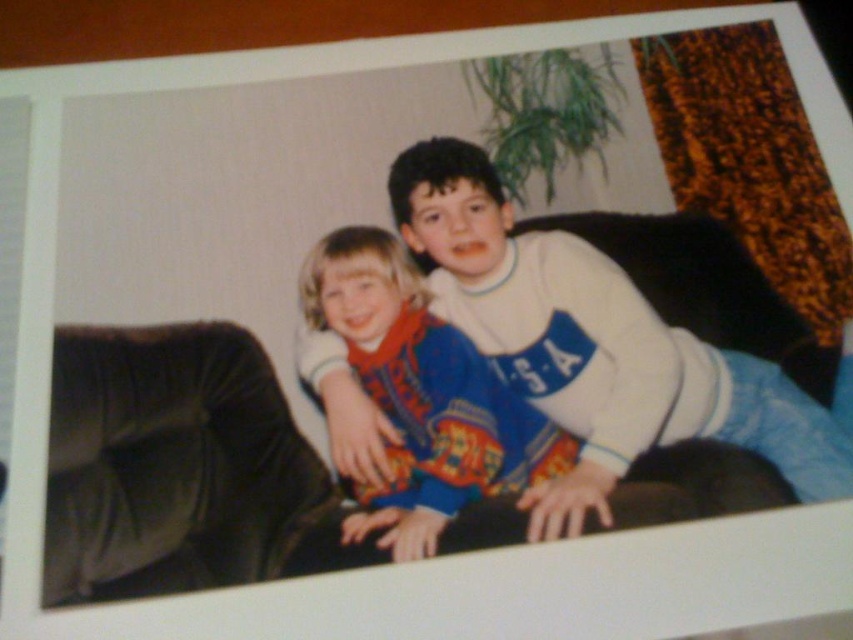
Question: Which point is closer to the camera?

Choices:
 (A) white cotton shirt at center
 (B) velvet brown couch at center
 (C) blue cotton shirt at center

Answer: (B)

Question: Which point is closer to the camera?

Choices:
 (A) (463, 211)
 (B) (386, 320)
 (C) (654, 256)

Answer: (B)

Question: Which object is positioned closest to the velvet brown couch at center?

Choices:
 (A) white cotton shirt at center
 (B) blue cotton shirt at center

Answer: (B)

Question: Does velvet brown couch at center appear under white cotton shirt at center?

Choices:
 (A) no
 (B) yes

Answer: (B)

Question: Does velvet brown couch at center have a greater width compared to blue cotton shirt at center?

Choices:
 (A) no
 (B) yes

Answer: (B)

Question: Is white cotton shirt at center above blue cotton shirt at center?

Choices:
 (A) yes
 (B) no

Answer: (A)